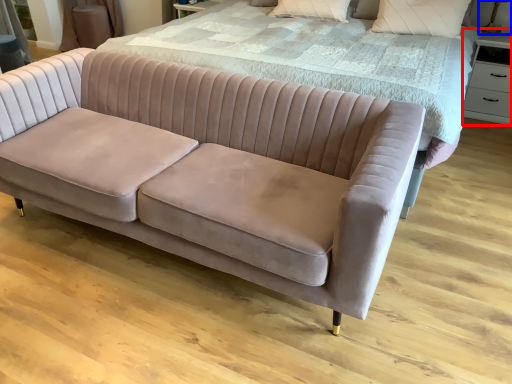
Question: Which of the following is the farthest to the observer, side table (highlighted by a red box) or table lamp (highlighted by a blue box)?

Choices:
 (A) side table
 (B) table lamp

Answer: (B)